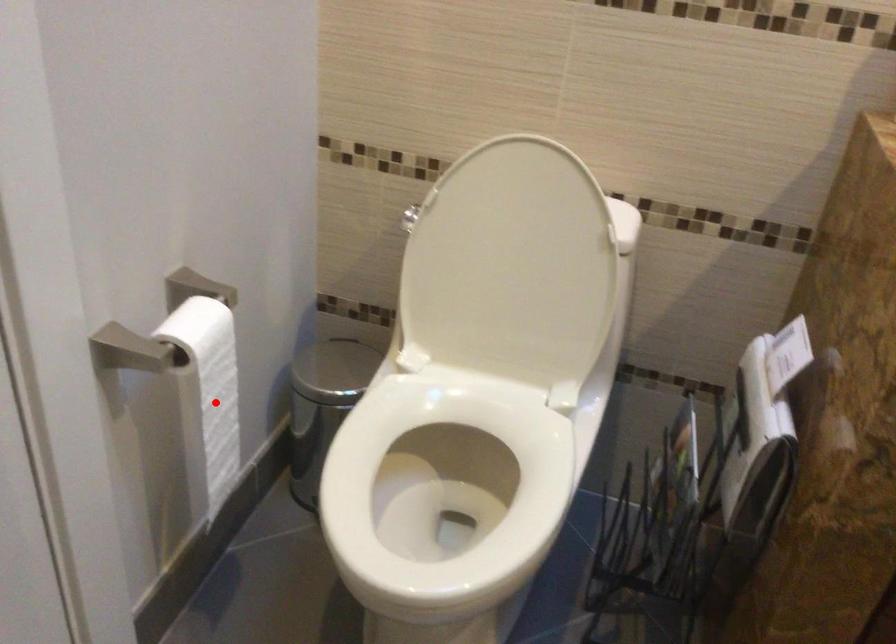
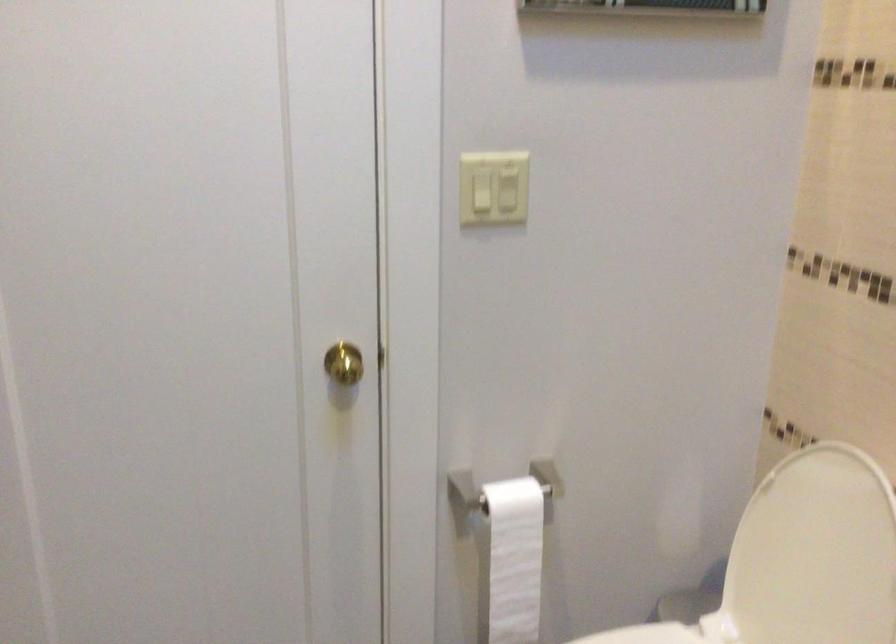
Find the pixel in the second image that matches the highlighted location in the first image.

(513, 560)